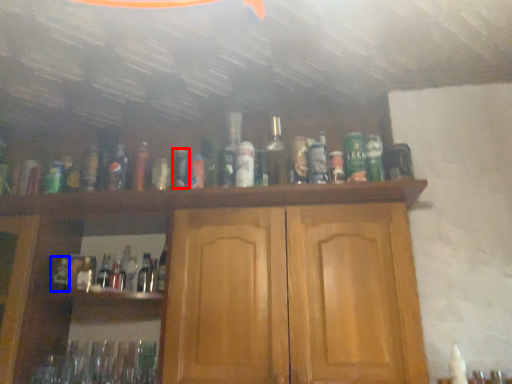
Question: Which point is further to the camera, bottle (highlighted by a red box) or bottle (highlighted by a blue box)?

Choices:
 (A) bottle
 (B) bottle

Answer: (B)